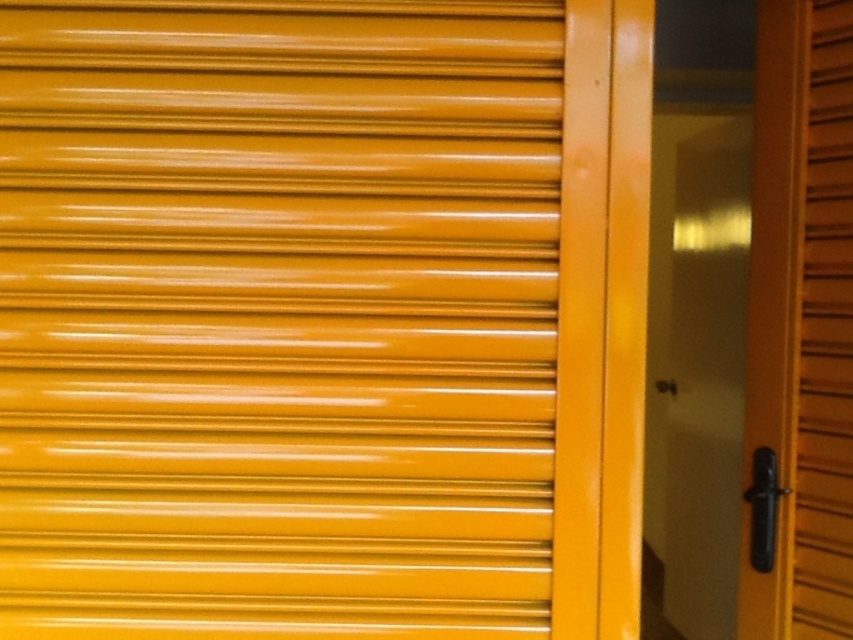
You are standing in front of a yellow metal rolling shutter door and need to determine the position of two points marked on the door. The points are labeled as point (654, 340) and point (809, 536). Which point is closer to you?

Point (809, 536) is closer to you because point (654, 340) is behind it.

From the picture: You are standing in front of a door and see two yellow shutters, the glossy yellow shutter at center and the matte yellow shutter at right. Which one is nearer to you?

The glossy yellow shutter at center is closer to the viewer than the matte yellow shutter at right.